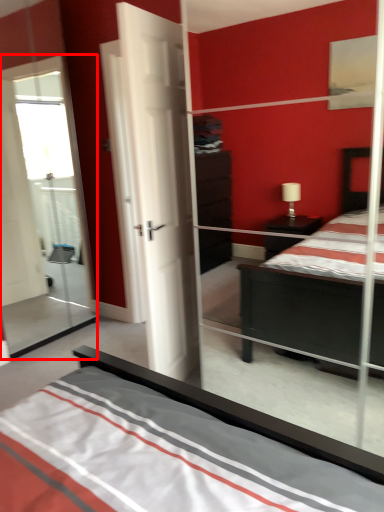
Question: Observing the image, what is the correct spatial positioning of glass door (annotated by the red box) in reference to door?

Choices:
 (A) right
 (B) left

Answer: (B)